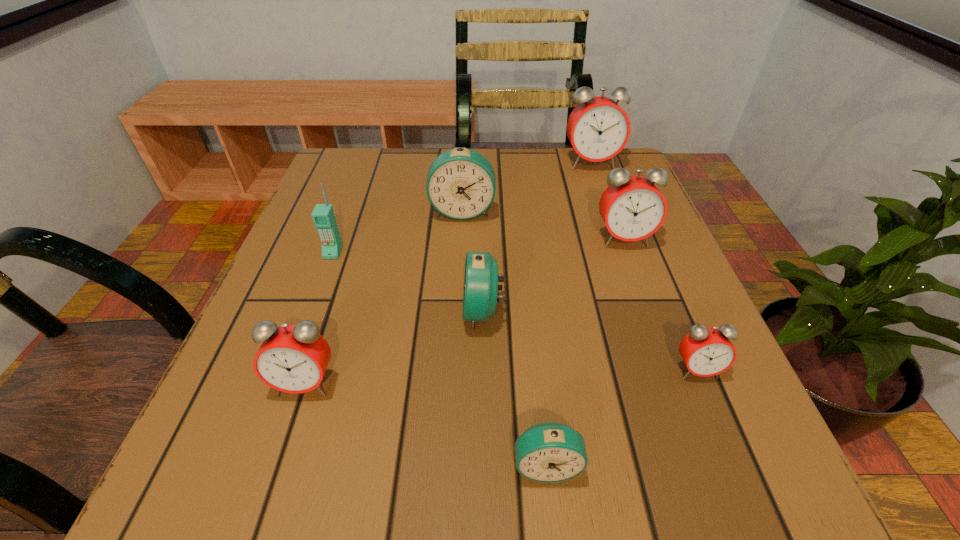
This screenshot has width=960, height=540. I want to click on free location at the right edge, so click(600, 283).

In the image, there is a desktop. Identify the location of vacant space at the far left corner. (351, 196).

This screenshot has height=540, width=960. What are the coordinates of `free region at the near left corner of the desktop` in the screenshot? It's located at (276, 455).

In the image, there is a desktop. Identify the location of vacant space at the far right corner. This screenshot has width=960, height=540. (574, 172).

Locate an element on the screen. The image size is (960, 540). vacant area between the tallest alarm clock and the second smallest blue alarm clock is located at coordinates (537, 237).

This screenshot has width=960, height=540. Find the location of `free space between the nearest blue alarm clock and the cellular telephone`. free space between the nearest blue alarm clock and the cellular telephone is located at coordinates (440, 359).

The width and height of the screenshot is (960, 540). Find the location of `vacant point located between the tallest object and the seventh nearest object`. vacant point located between the tallest object and the seventh nearest object is located at coordinates (527, 187).

You are a GUI agent. You are given a task and a screenshot of the screen. Output one action in this format:
    pyautogui.click(x=<x>, y=<y>)
    Task: Click on the vacant space in between the leftmost red alarm clock and the smallest red alarm clock
    This screenshot has height=540, width=960.
    Given the screenshot: What is the action you would take?
    pyautogui.click(x=501, y=376)

The height and width of the screenshot is (540, 960). I want to click on blank region between the third nearest red alarm clock and the cellular telephone, so click(x=478, y=246).

The height and width of the screenshot is (540, 960). In order to click on unoccupied position between the third farthest alarm clock and the cellular telephone in this screenshot , I will do `click(478, 246)`.